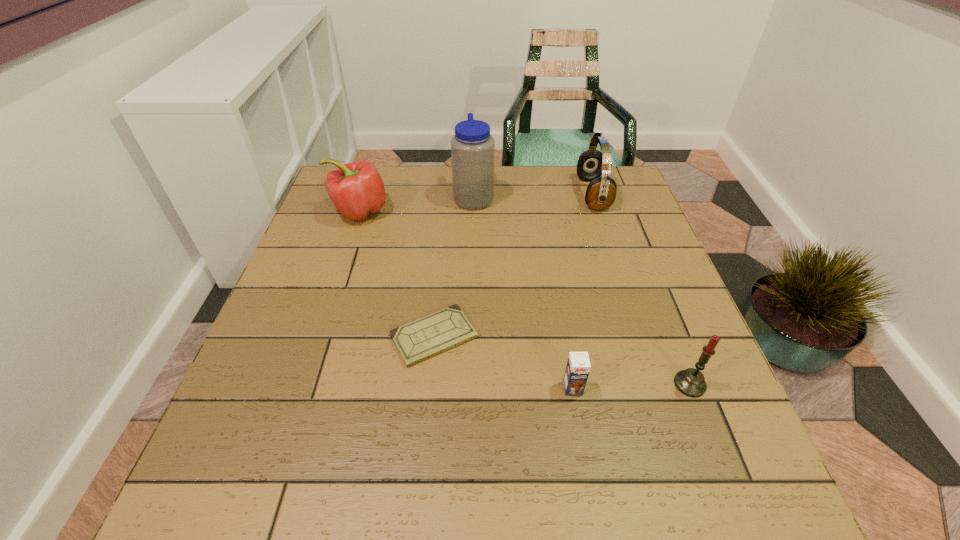
Locate an element on the screen. This screenshot has height=540, width=960. water bottle is located at coordinates (472, 147).

Identify the location of headset. (601, 192).

Locate an element on the screen. the leftmost object is located at coordinates (356, 189).

Locate an element on the screen. candle is located at coordinates (691, 382).

Find the location of a particular element. This screenshot has height=540, width=960. chocolate milk is located at coordinates pyautogui.click(x=578, y=366).

This screenshot has height=540, width=960. I want to click on the third object from right to left, so click(x=578, y=366).

In order to click on checkbook in this screenshot , I will do `click(416, 341)`.

Identify the location of the fourth farthest object. (416, 341).

Where is `vacant space positioned 0.370m with a carrying loop on the side of the water bottle`? The height and width of the screenshot is (540, 960). vacant space positioned 0.370m with a carrying loop on the side of the water bottle is located at coordinates (620, 197).

Image resolution: width=960 pixels, height=540 pixels. Identify the location of free space located 0.310m on the ear cups of the headset. (473, 194).